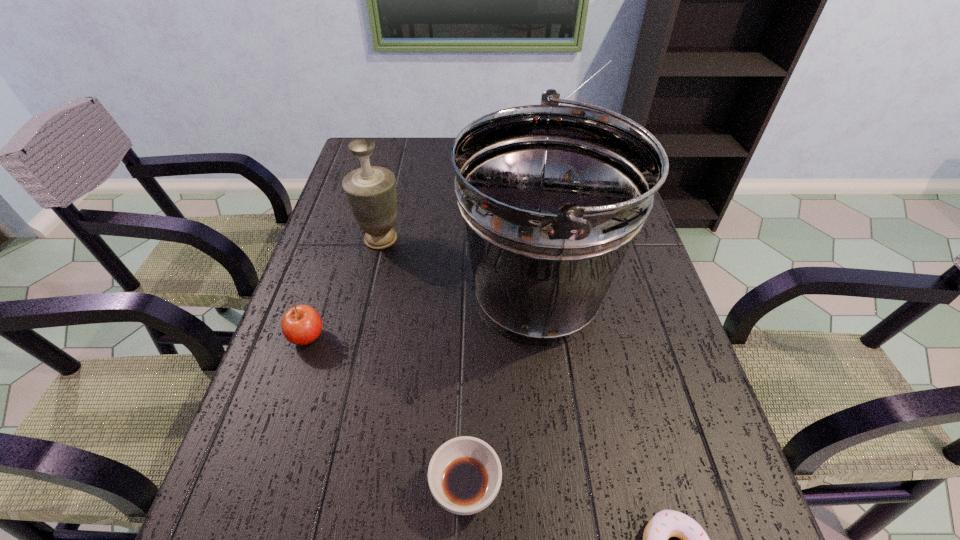
Find the location of a particular element. The width and height of the screenshot is (960, 540). vacant area between the soup bowl and the fifth object from right to left is located at coordinates point(423,363).

At what (x,y) coordinates should I click in order to perform the action: click on free spot between the second object from left to right and the leftmost object. Please return your answer as a coordinate pair (x, y). The width and height of the screenshot is (960, 540). Looking at the image, I should click on (344, 288).

Identify the location of vacant space in between the radio receiver and the leftmost object. (431, 250).

Locate an element on the screen. The image size is (960, 540). unoccupied position between the urn and the fifth tallest object is located at coordinates (423, 363).

This screenshot has height=540, width=960. Find the location of `object that ranks as the fourth closest to the urn`. object that ranks as the fourth closest to the urn is located at coordinates (464, 475).

Identify which object is located as the fifth nearest to the fifth tallest object. Please provide its 2D coordinates. Your answer should be formatted as a tuple, i.e. [(x, y)], where the tuple contains the x and y coordinates of a point satisfying the conditions above.

[(610, 60)]

Find the location of `vacant area in the image that satisfies the following two spatial constraints: 1. on the back side of the apple; 2. on the right side of the fifth object from right to left`. vacant area in the image that satisfies the following two spatial constraints: 1. on the back side of the apple; 2. on the right side of the fifth object from right to left is located at coordinates (340, 239).